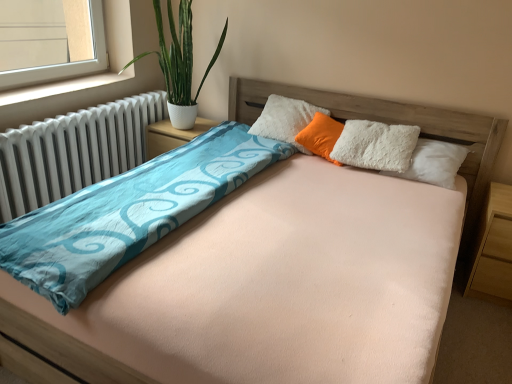
The width and height of the screenshot is (512, 384). Describe the element at coordinates (321, 136) in the screenshot. I see `white fluffy pillow at center` at that location.

What do you see at coordinates (61, 87) in the screenshot? The image size is (512, 384). I see `white plastic window sill at left` at bounding box center [61, 87].

What do you see at coordinates (178, 54) in the screenshot? This screenshot has width=512, height=384. I see `green leafy plant in white pot at left` at bounding box center [178, 54].

Measure the distance between point (492, 282) and camera.

Point (492, 282) and camera are 2.24 meters apart from each other.

You are a GUI agent. You are given a task and a screenshot of the screen. Output one action in this format:
    pyautogui.click(x=<x>, y=<y>)
    Task: Click on the white fluffy pillow at center
    
    Given the screenshot: What is the action you would take?
    point(321,136)

Consider the image. Which object is further away from the camera taking this photo, white fluffy pillow at center or white plastic window sill at left?

white fluffy pillow at center is further away from the camera.

Is white fluffy pillow at center oriented towards white plastic window sill at left?

No, white fluffy pillow at center is not turned towards white plastic window sill at left.

Is white fluffy pillow at center far from white plastic window sill at left?

Indeed, white fluffy pillow at center is not near white plastic window sill at left.

Does white fluffy pillow at center have a smaller size compared to white plastic window sill at left?

No, white fluffy pillow at center is not smaller than white plastic window sill at left.

Considering the points (71, 119) and (485, 272), which point is behind, point (71, 119) or point (485, 272)?

The point (71, 119) is farther from the camera.

From the picture: From the image's perspective, who appears lower, white metallic radiator at left or light brown wood at right, marked as the 1th nightstand in a bottom-to-top arrangement?

light brown wood at right, marked as the 1th nightstand in a bottom-to-top arrangement, is shown below in the image.

Does white metallic radiator at left contain light brown wood at right, marked as the 1th nightstand in a front-to-back arrangement?

That's incorrect, light brown wood at right, marked as the 1th nightstand in a front-to-back arrangement, is not inside white metallic radiator at left.

Does white metallic radiator at left lie in front of light brown wood at right, which is the second nightstand from left to right?

No.

Is light brown wood at right, arranged as the 1th nightstand when viewed from the right, oriented away from white textured nightstand at center, which is the first nightstand in left-to-right order?

That's not correct — light brown wood at right, arranged as the 1th nightstand when viewed from the right, is not looking away from white textured nightstand at center, which is the first nightstand in left-to-right order.

Considering the points (467, 289) and (156, 131), which point is behind, point (467, 289) or point (156, 131)?

The point (156, 131) is farther.

Considering the relative sizes of light brown wood at right, arranged as the 1th nightstand when viewed from the right, and white textured nightstand at center, positioned as the 2th nightstand in front-to-back order, in the image provided, is light brown wood at right, arranged as the 1th nightstand when viewed from the right, wider than white textured nightstand at center, positioned as the 2th nightstand in front-to-back order,?

No.

How different are the orientations of light brown wood at right, which is the second nightstand from left to right, and white textured nightstand at center, positioned as the 2th nightstand in front-to-back order, in degrees?

light brown wood at right, which is the second nightstand from left to right, and white textured nightstand at center, positioned as the 2th nightstand in front-to-back order, are facing 0.388 degrees away from each other.

Is white plastic window sill at left at the right side of white fluffy pillow at center?

Incorrect, white plastic window sill at left is not on the right side of white fluffy pillow at center.

Between point (101, 82) and point (326, 145), which one is positioned in front?

The point (326, 145) is closer.

This screenshot has height=384, width=512. I want to click on window sill that is in front of the white fluffy pillow at center, so click(61, 87).

Would you consider white plastic window sill at left to be distant from white fluffy pillow at center?

white plastic window sill at left is positioned a significant distance from white fluffy pillow at center.

There is a white textured nightstand at center, arranged as the second nightstand when ordered from the bottom. Identify the location of plant above it (from a real-world perspective). (178, 54).

Is there a large distance between green leafy plant in white pot at left and white textured nightstand at center, positioned as the 2th nightstand in front-to-back order?

No, there isn't a large distance between green leafy plant in white pot at left and white textured nightstand at center, positioned as the 2th nightstand in front-to-back order.

Is green leafy plant in white pot at left oriented away from white textured nightstand at center, positioned as the 2th nightstand in front-to-back order?

No, white textured nightstand at center, positioned as the 2th nightstand in front-to-back order, is not at the back of green leafy plant in white pot at left.

Considering the sizes of green leafy plant in white pot at left and white textured nightstand at center, arranged as the second nightstand when ordered from the bottom, in the image, is green leafy plant in white pot at left bigger or smaller than white textured nightstand at center, arranged as the second nightstand when ordered from the bottom,?

Considering their sizes, green leafy plant in white pot at left takes up more space than white textured nightstand at center, arranged as the second nightstand when ordered from the bottom.

Is white fluffy pillow at center positioned with its back to white metallic radiator at left?

white fluffy pillow at center is not turned away from white metallic radiator at left.

Is white fluffy pillow at center positioned beyond the bounds of white metallic radiator at left?

Indeed, white fluffy pillow at center is completely outside white metallic radiator at left.

From a real-world perspective, is white fluffy pillow at center physically above white metallic radiator at left?

Yes, from a real-world perspective, white fluffy pillow at center is above white metallic radiator at left.

Looking at this image, which object is thinner, white fluffy pillow at center or white metallic radiator at left?

Thinner between the two is white fluffy pillow at center.

Could you tell me if white textured nightstand at center, which is the first nightstand in left-to-right order, is facing light brown wood at right, acting as the 2th nightstand starting from the back?

No, white textured nightstand at center, which is the first nightstand in left-to-right order, is not turned towards light brown wood at right, acting as the 2th nightstand starting from the back.

Between white textured nightstand at center, arranged as the 1th nightstand when viewed from the top, and light brown wood at right, marked as the 1th nightstand in a front-to-back arrangement, which one has larger size?

light brown wood at right, marked as the 1th nightstand in a front-to-back arrangement, is bigger.

Would you say white textured nightstand at center, positioned as the 2th nightstand in front-to-back order, is to the left or to the right of light brown wood at right, which is the second nightstand from left to right, in the picture?

Clearly, white textured nightstand at center, positioned as the 2th nightstand in front-to-back order, is on the left of light brown wood at right, which is the second nightstand from left to right, in the image.

Identify the location of window sill above the white fluffy pillow at center (from a real-world perspective). pyautogui.click(x=61, y=87).

Identify the location of the 2nd nightstand directly beneath the white metallic radiator at left (from a real-world perspective). (494, 250).

Estimate the real-world distances between objects in this image. Which object is further from white fluffy pillow at center, light brown wood at right, marked as the 1th nightstand in a front-to-back arrangement, or white textured nightstand at center, arranged as the 1th nightstand when viewed from the top?

light brown wood at right, marked as the 1th nightstand in a front-to-back arrangement.

Considering their positions, is white metallic radiator at left positioned closer to white textured nightstand at center, arranged as the second nightstand when ordered from the bottom, than light brown wood at right, marked as the 1th nightstand in a bottom-to-top arrangement?

white metallic radiator at left is closer to white textured nightstand at center, arranged as the second nightstand when ordered from the bottom.

When comparing their distances from white plastic window sill at left, does light brown wood at right, acting as the 2th nightstand starting from the back, or white metallic radiator at left seem closer?

white metallic radiator at left is closer to white plastic window sill at left.

Considering their positions, is white metallic radiator at left positioned further to white textured nightstand at center, the second nightstand when ordered from right to left, than white plastic window sill at left?

white plastic window sill at left.

Looking at the image, which one is located further to white fluffy pillow at center, white metallic radiator at left or white textured nightstand at center, arranged as the second nightstand when ordered from the bottom?

white metallic radiator at left is further to white fluffy pillow at center.

Which object lies nearer to the anchor point green leafy plant in white pot at left, white textured nightstand at center, the second nightstand when ordered from right to left, or white plastic window sill at left?

Among the two, white textured nightstand at center, the second nightstand when ordered from right to left, is located nearer to green leafy plant in white pot at left.

When comparing their distances from white fluffy pillow at center, does light brown wood at right, acting as the 2th nightstand starting from the back, or green leafy plant in white pot at left seem further?

green leafy plant in white pot at left is further to white fluffy pillow at center.

Which object lies further to the anchor point white fluffy pillow at center, white plastic window sill at left or white metallic radiator at left?

white plastic window sill at left is further to white fluffy pillow at center.

This screenshot has width=512, height=384. Identify the location of pillow between white plastic window sill at left and light brown wood at right, arranged as the 1th nightstand when viewed from the right, in the horizontal direction. (321, 136).

Where is `plant between white textured nightstand at center, which is the first nightstand in left-to-right order, and light brown wood at right, which is the second nightstand from left to right, from left to right`? This screenshot has height=384, width=512. plant between white textured nightstand at center, which is the first nightstand in left-to-right order, and light brown wood at right, which is the second nightstand from left to right, from left to right is located at coordinates (178, 54).

Where is `plant situated between white metallic radiator at left and white fluffy pillow at center from left to right`? Image resolution: width=512 pixels, height=384 pixels. plant situated between white metallic radiator at left and white fluffy pillow at center from left to right is located at coordinates (178, 54).

Where is `pillow located between white textured nightstand at center, which is the first nightstand in left-to-right order, and light brown wood at right, marked as the 1th nightstand in a front-to-back arrangement, in the left-right direction`? Image resolution: width=512 pixels, height=384 pixels. pillow located between white textured nightstand at center, which is the first nightstand in left-to-right order, and light brown wood at right, marked as the 1th nightstand in a front-to-back arrangement, in the left-right direction is located at coordinates (321, 136).